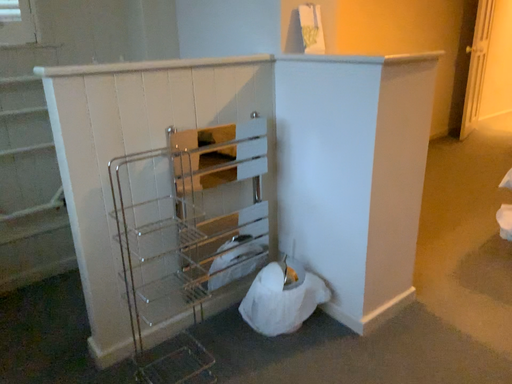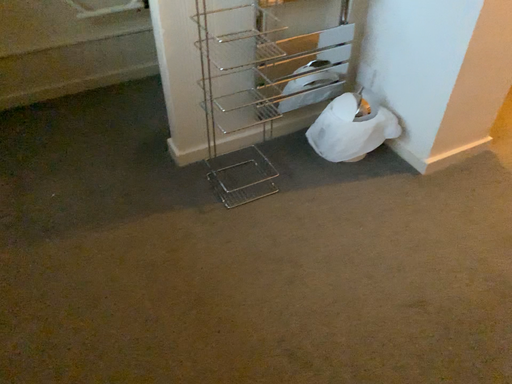
Question: How did the camera likely rotate when shooting the video?

Choices:
 (A) rotated left
 (B) rotated right

Answer: (A)